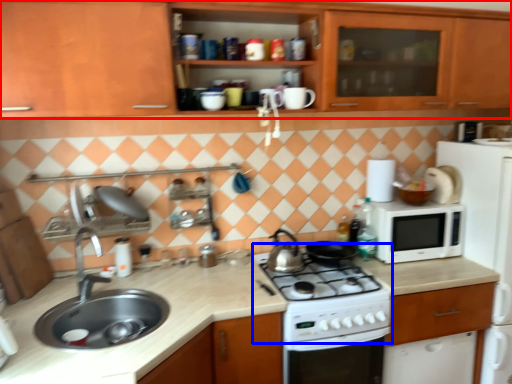
Question: Which point is further to the camera, cabinetry (highlighted by a red box) or gas stove (highlighted by a blue box)?

Choices:
 (A) cabinetry
 (B) gas stove

Answer: (B)